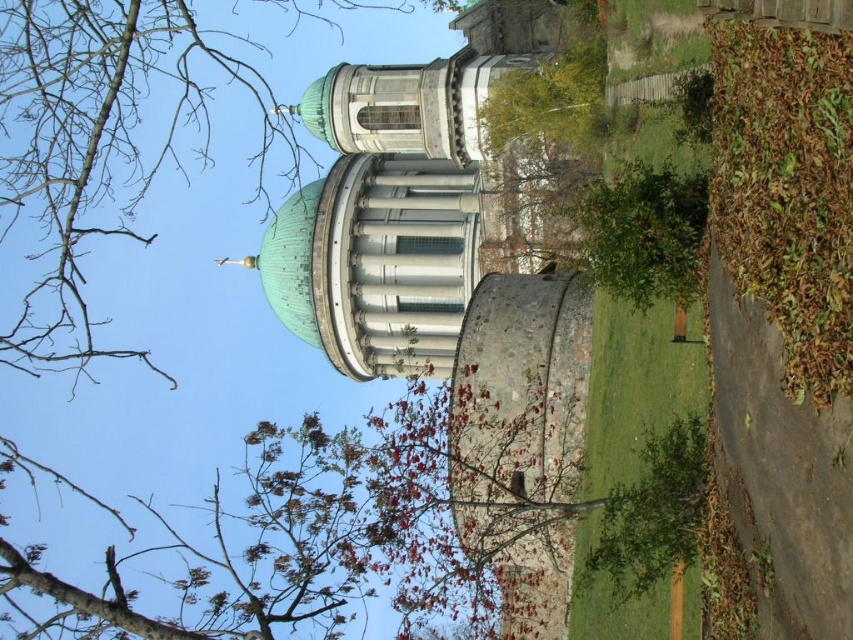
You are standing in front of the architectural structure and notice the green dome at center and the brown leafy tree at upper center. Which object appears taller in the scene?

The brown leafy tree at upper center is taller than the green dome at center.

You are standing at the center of the image. Which direction should you move to reach the green dome at center?

The green dome at center is located at point coordinates 0.312 on the x axis and 0.469 on the y axis. Since you are at the center of the image, which is point 0.5 on both axes, you should move southwest to reach the green dome at center.